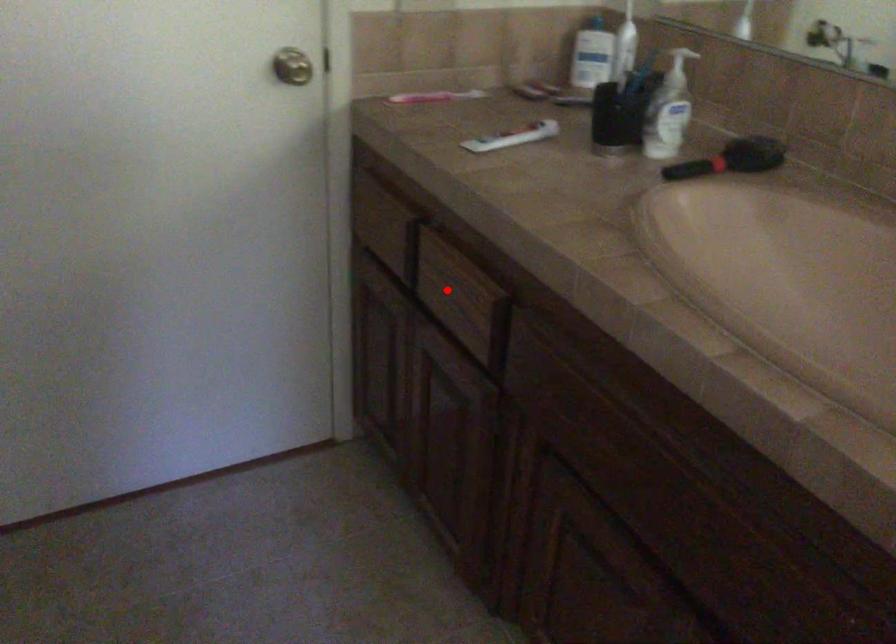
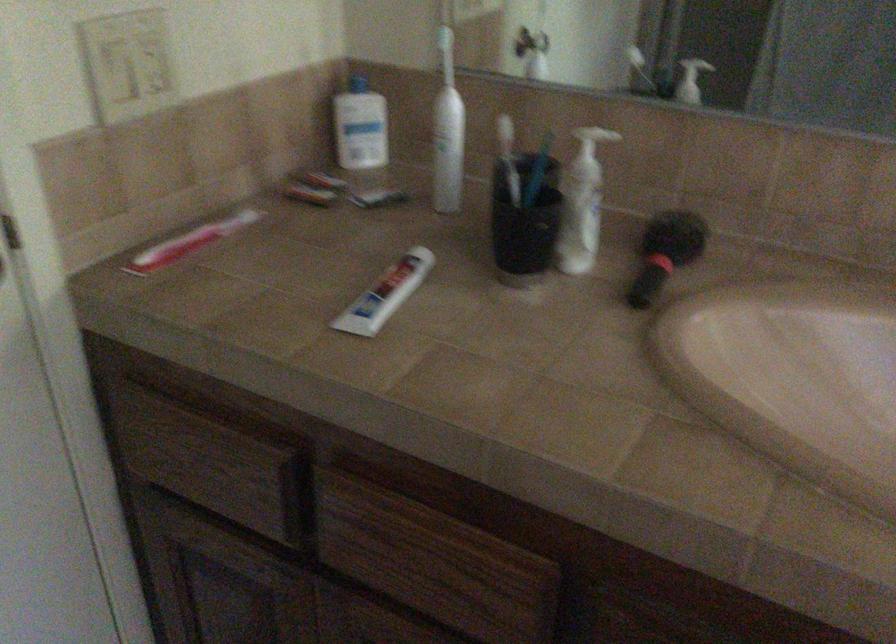
Question: I am providing you with two images of the same scene from different viewpoints. Image1 has a red point marked. In image2, the corresponding 3D location appears at what relative position? Reply with the corresponding letter.

Choices:
 (A) Closer
 (B) Farther

Answer: (A)